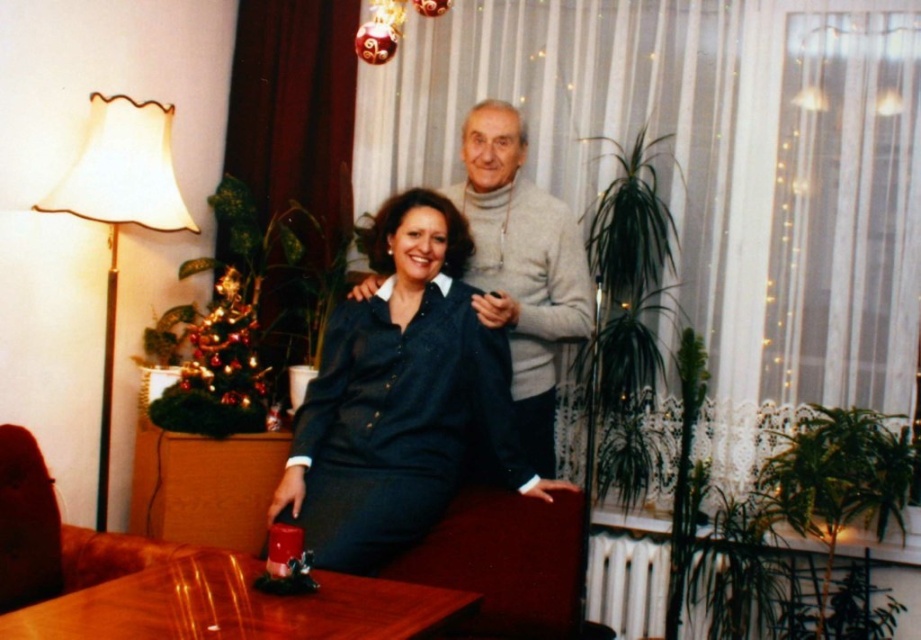
You are planning to place a decorative wreath between the light gray turtleneck sweater at center and the shiny metallic christmas tree at left. Based on their widths, which object should the wreath be placed closer to?

The wreath should be placed closer to the shiny metallic christmas tree at left because the light gray turtleneck sweater at center might be wider than the shiny metallic christmas tree at left, so the tree is narrower and the wreath would fit better there.

You are a photographer setting up a shot in this scene. You need to ensure that the light gray turtleneck sweater at center and the shiny metallic christmas tree at left are both in focus. Based on their heights, which object should you adjust your camera focus on first to ensure proper framing?

The light gray turtleneck sweater at center is taller than the shiny metallic christmas tree at left, so you should focus on the taller object first to ensure proper framing.

Based on the scene description, where is the denim shirt at center located in terms of its 2D coordinates?

The denim shirt at center is located at the 2D coordinates point (401,397).